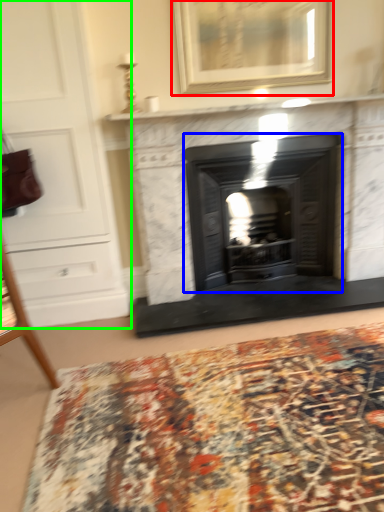
Question: Based on their relative distances, which object is nearer to picture frame (highlighted by a red box)? Choose from wood burning stove (highlighted by a blue box) and dresser (highlighted by a green box).

Choices:
 (A) wood burning stove
 (B) dresser

Answer: (A)